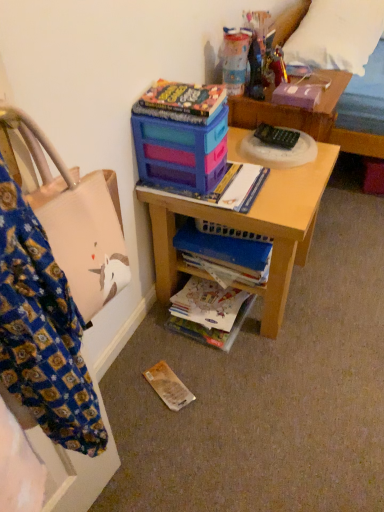
I want to click on free space in front of brown paper book at lower center, positioned as the 1th paperback book in bottom-to-top order, so click(x=162, y=435).